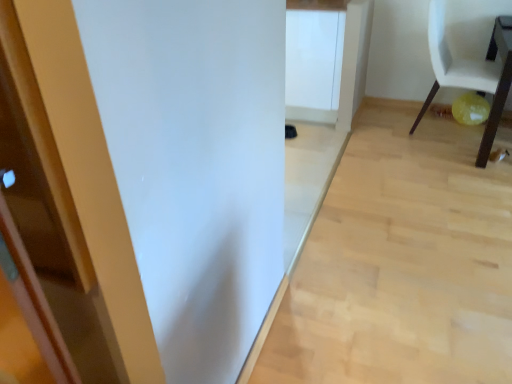
Question: Is white matte cabinet at center outside of white matte chair at right?

Choices:
 (A) no
 (B) yes

Answer: (B)

Question: Is white matte cabinet at center not near white matte chair at right?

Choices:
 (A) no
 (B) yes

Answer: (A)

Question: Is white matte cabinet at center aimed at white matte chair at right?

Choices:
 (A) yes
 (B) no

Answer: (B)

Question: Can you confirm if white matte cabinet at center is thinner than white matte chair at right?

Choices:
 (A) yes
 (B) no

Answer: (B)

Question: Can you confirm if white matte cabinet at center is wider than white matte chair at right?

Choices:
 (A) no
 (B) yes

Answer: (B)

Question: From their relative heights in the image, would you say white matte chair at right is taller or shorter than wooden table at lower right?

Choices:
 (A) short
 (B) tall

Answer: (B)

Question: From the image's perspective, relative to wooden table at lower right, is white matte chair at right above or below?

Choices:
 (A) above
 (B) below

Answer: (A)

Question: In terms of size, does white matte chair at right appear bigger or smaller than wooden table at lower right?

Choices:
 (A) small
 (B) big

Answer: (B)

Question: Is white matte chair at right wider or thinner than wooden table at lower right?

Choices:
 (A) thin
 (B) wide

Answer: (A)

Question: From a real-world perspective, relative to white matte cabinet at center, is wooden table at lower right vertically above or below?

Choices:
 (A) above
 (B) below

Answer: (B)

Question: Considering the positions of point (501, 79) and point (330, 54), is point (501, 79) closer or farther from the camera than point (330, 54)?

Choices:
 (A) farther
 (B) closer

Answer: (B)

Question: Is wooden table at lower right wider or thinner than white matte cabinet at center?

Choices:
 (A) thin
 (B) wide

Answer: (B)

Question: From their relative heights in the image, would you say wooden table at lower right is taller or shorter than white matte cabinet at center?

Choices:
 (A) short
 (B) tall

Answer: (A)

Question: In the image, is white matte chair at right positioned in front of or behind light wood floor at center?

Choices:
 (A) behind
 (B) front

Answer: (A)

Question: Considering the positions of white matte chair at right and light wood floor at center in the image, is white matte chair at right wider or thinner than light wood floor at center?

Choices:
 (A) wide
 (B) thin

Answer: (B)